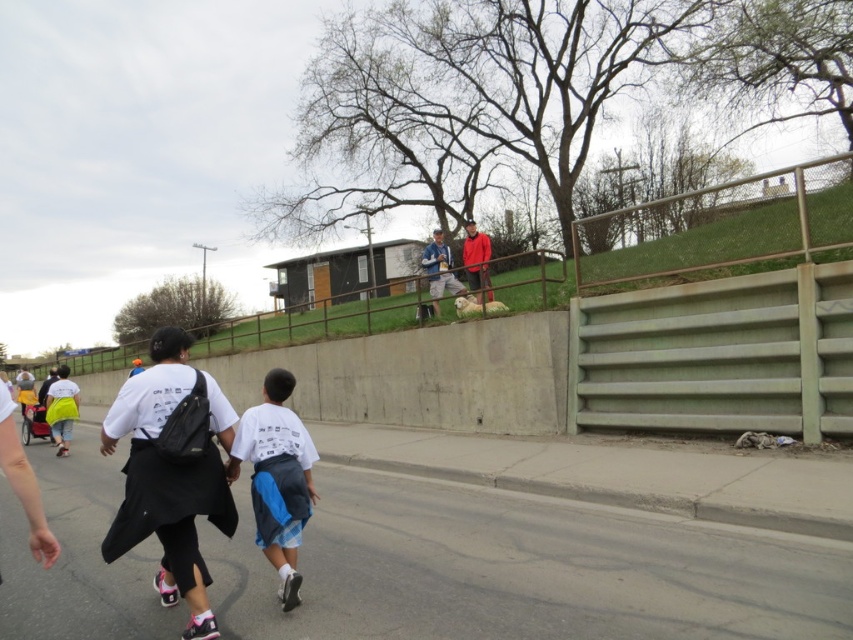
You are a photographer standing on the paved road. You want to take a photo of the matte blue shirt at center and the matte red jacket at upper center. Which of the two objects would appear narrower in the photo?

The matte blue shirt at center would appear narrower in the photo since it is thinner than the matte red jacket at upper center according to the description.

You are a photographer trying to capture a photo of the two people in the scene. You want to ensure that both the white cotton shirt at center and the matte blue shirt at center are clearly visible. Given their sizes, which shirt might require you to adjust your camera focus more carefully to avoid blurriness?

The white cotton shirt at center is thinner than the matte blue shirt at center, so the white cotton shirt at center might require more careful focus adjustment to ensure clarity since it has a smaller size.